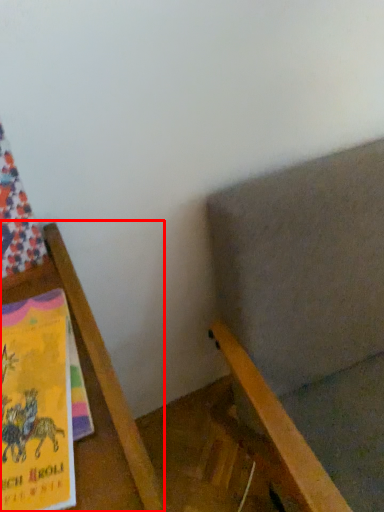
Question: From the image, what is the correct spatial relationship of furniture (annotated by the red box) in relation to chair?

Choices:
 (A) right
 (B) left

Answer: (B)